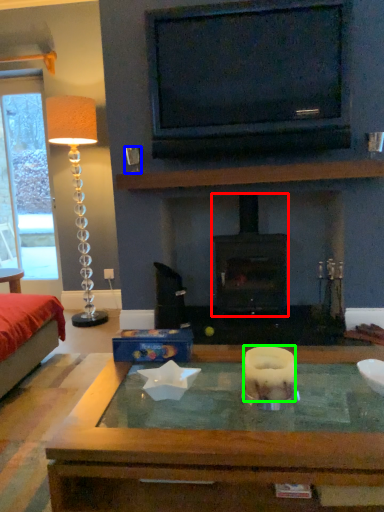
Question: Which is nearer to the wood burning stove (highlighted by a red box)? coffee cup (highlighted by a blue box) or candle (highlighted by a green box).

Choices:
 (A) coffee cup
 (B) candle

Answer: (A)